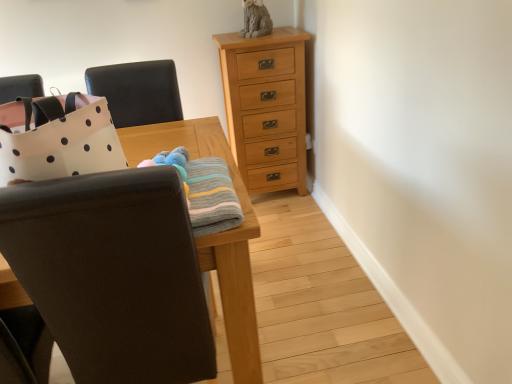
Question: From the image's perspective, is matte black chair at left, the 2th chair viewed from the top, located above natural wood chest of drawers at upper center?

Choices:
 (A) yes
 (B) no

Answer: (B)

Question: Does matte black chair at left, which is the first chair from bottom to top, lie behind natural wood chest of drawers at upper center?

Choices:
 (A) yes
 (B) no

Answer: (B)

Question: From a real-world perspective, is matte black chair at left, which is the first chair from bottom to top, located beneath natural wood chest of drawers at upper center?

Choices:
 (A) yes
 (B) no

Answer: (B)

Question: Can you confirm if matte black chair at left, the 2th chair viewed from the top, is thinner than natural wood chest of drawers at upper center?

Choices:
 (A) no
 (B) yes

Answer: (A)

Question: Would you say natural wood chest of drawers at upper center is part of matte black chair at left, the 2th chair viewed from the top,'s contents?

Choices:
 (A) no
 (B) yes

Answer: (A)

Question: From a real-world perspective, is black leather chair at upper left, which appears as the 1th chair when viewed from the top, above or below natural wood chest of drawers at upper center?

Choices:
 (A) above
 (B) below

Answer: (A)

Question: From the image's perspective, relative to natural wood chest of drawers at upper center, is black leather chair at upper left, which appears as the 1th chair when viewed from the top, above or below?

Choices:
 (A) above
 (B) below

Answer: (B)

Question: Does point (117, 66) appear closer or farther from the camera than point (280, 94)?

Choices:
 (A) closer
 (B) farther

Answer: (A)

Question: Choose the correct answer: Is black leather chair at upper left, which appears as the 1th chair when viewed from the top, inside natural wood chest of drawers at upper center or outside it?

Choices:
 (A) outside
 (B) inside

Answer: (A)

Question: Which is correct: knitted woolen blanket at center is inside black leather chair at upper left, which appears as the 1th chair when viewed from the top, or outside of it?

Choices:
 (A) outside
 (B) inside

Answer: (A)

Question: Based on their sizes in the image, would you say knitted woolen blanket at center is bigger or smaller than black leather chair at upper left, which appears as the 1th chair when viewed from the top?

Choices:
 (A) big
 (B) small

Answer: (B)

Question: Based on their positions, is knitted woolen blanket at center located to the left or right of black leather chair at upper left, which appears as the 1th chair when viewed from the top?

Choices:
 (A) right
 (B) left

Answer: (A)

Question: Relative to black leather chair at upper left, which appears as the 1th chair when viewed from the top, is knitted woolen blanket at center in front or behind?

Choices:
 (A) front
 (B) behind

Answer: (A)

Question: Is matte black chair at left, the 2th chair viewed from the top, bigger or smaller than natural wood chest of drawers at upper center?

Choices:
 (A) small
 (B) big

Answer: (B)

Question: Is matte black chair at left, which is the first chair from bottom to top, in front of or behind natural wood chest of drawers at upper center in the image?

Choices:
 (A) behind
 (B) front

Answer: (B)